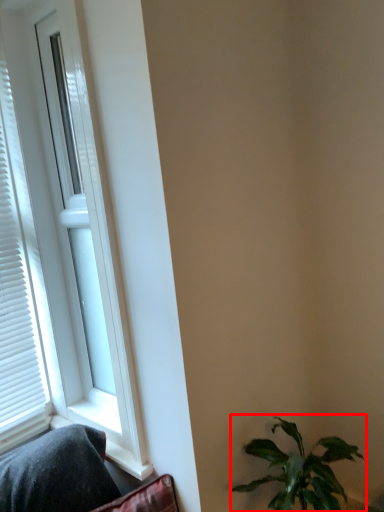
Question: Considering the relative positions of houseplant (annotated by the red box) and window in the image provided, where is houseplant (annotated by the red box) located with respect to the staircase?

Choices:
 (A) right
 (B) left

Answer: (A)